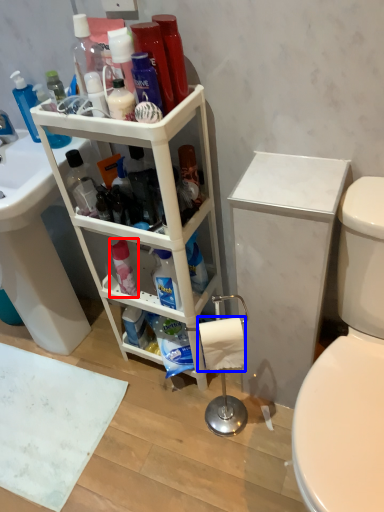
Question: Which of the following is the farthest to the observer, cleaning product (highlighted by a red box) or toilet paper (highlighted by a blue box)?

Choices:
 (A) cleaning product
 (B) toilet paper

Answer: (A)